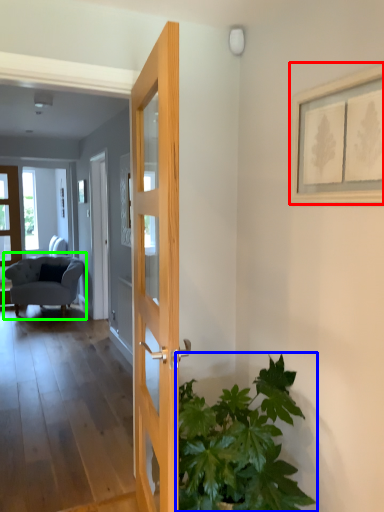
Question: Considering the real-world distances, which object is farthest from picture frame (highlighted by a red box)? houseplant (highlighted by a blue box) or chair (highlighted by a green box)?

Choices:
 (A) houseplant
 (B) chair

Answer: (B)